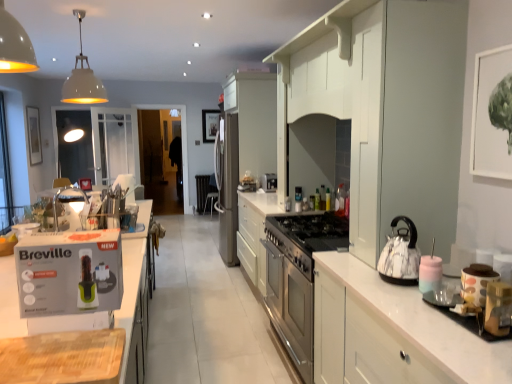
Locate an element on the screen. This screenshot has height=384, width=512. vacant space situated above white matte pendant lamp at upper center (from a real-world perspective) is located at coordinates (84, 6).